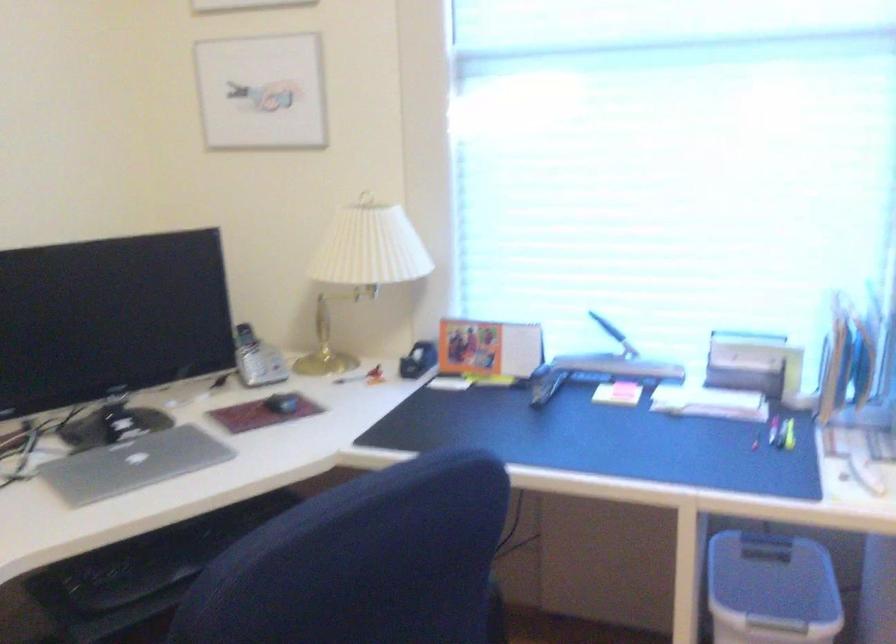
The location [281,402] corresponds to which object?

This point indicates the black computer mouse.